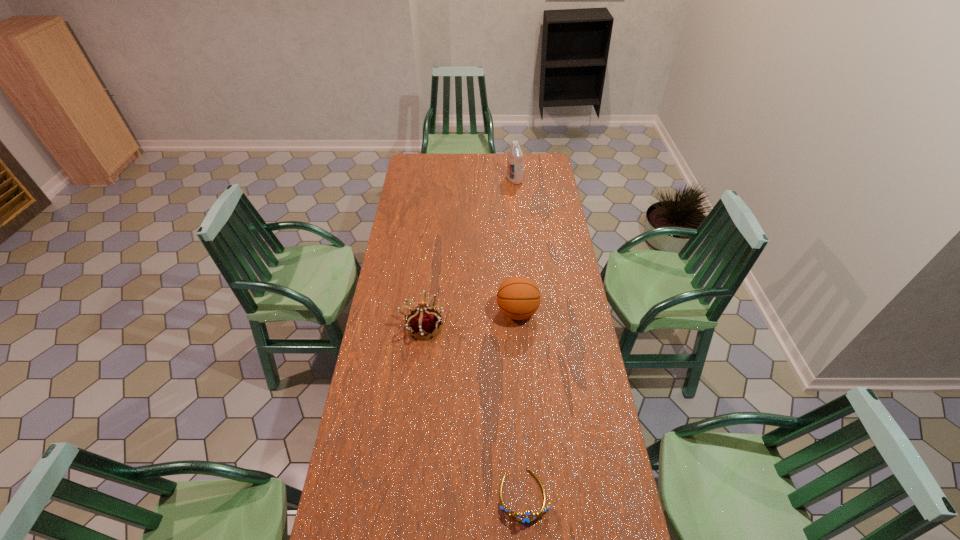
Where is `detergent`? detergent is located at coordinates (515, 155).

Locate an element on the screen. the tallest object is located at coordinates (515, 155).

Identify the location of the left tiara. (423, 320).

This screenshot has height=540, width=960. I want to click on the taller tiara, so click(423, 320).

Locate an element on the screen. The image size is (960, 540). basketball is located at coordinates (518, 297).

The image size is (960, 540). What are the coordinates of `the nearest object` in the screenshot? It's located at (531, 517).

This screenshot has height=540, width=960. What are the coordinates of `the right tiara` in the screenshot? It's located at (531, 517).

Image resolution: width=960 pixels, height=540 pixels. I want to click on vacant space located 0.350m on the left of the farthest object, so click(x=447, y=180).

Identify the location of vacant space located 0.120m on the front-facing side of the taller tiara. This screenshot has height=540, width=960. (x=472, y=327).

Where is `free space located on the back of the basketball`? free space located on the back of the basketball is located at coordinates (513, 251).